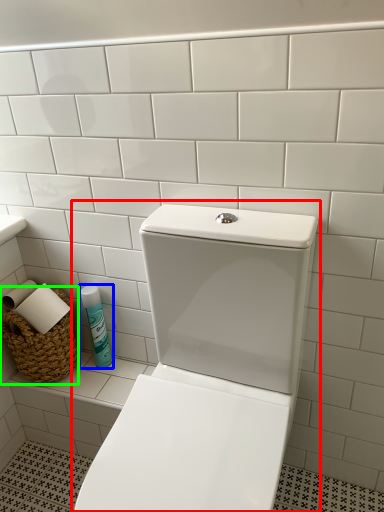
Question: Which object is the closest to the toilet (highlighted by a red box)? Choose among these: cleaning product (highlighted by a blue box) or basket (highlighted by a green box).

Choices:
 (A) cleaning product
 (B) basket

Answer: (A)